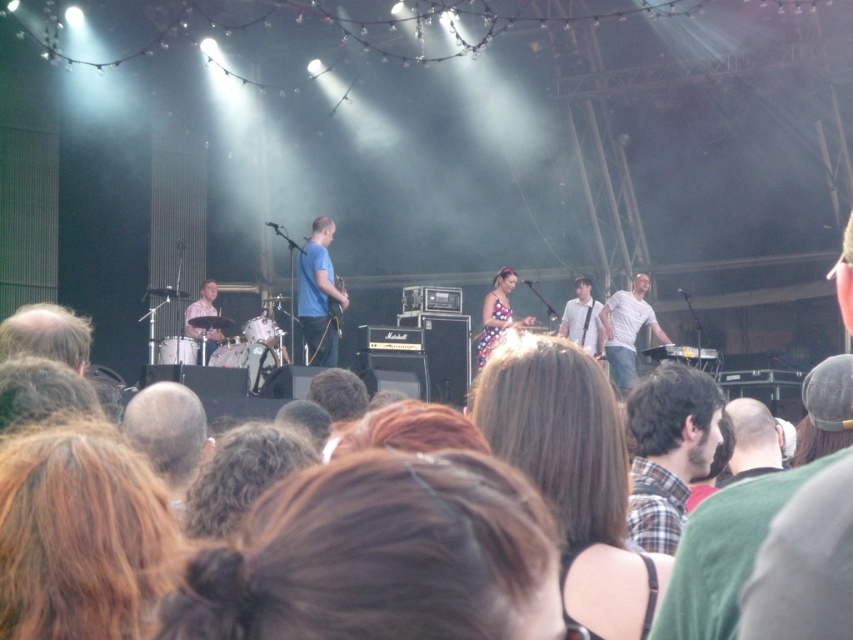
Question: Which point is closer to the camera?

Choices:
 (A) plaid shirt at center
 (B) brown hair at center
 (C) matte blue shirt at left
 (D) blue fabric shirt at center

Answer: (B)

Question: Is blonde hair at lower left further to the viewer compared to white shirt at center?

Choices:
 (A) yes
 (B) no

Answer: (B)

Question: Which object appears farthest from the camera in this image?

Choices:
 (A) plaid shirt at center
 (B) white cotton shirt at right
 (C) matte blue shirt at left

Answer: (B)

Question: Which of these objects is positioned closest to the white cotton shirt at right?

Choices:
 (A) white shirt at center
 (B) brown hair at center
 (C) matte blue shirt at left
 (D) blue fabric shirt at center

Answer: (A)

Question: Is plaid shirt at center above white shirt at center?

Choices:
 (A) no
 (B) yes

Answer: (A)

Question: Is brown hair at center bigger than matte blue shirt at left?

Choices:
 (A) yes
 (B) no

Answer: (B)